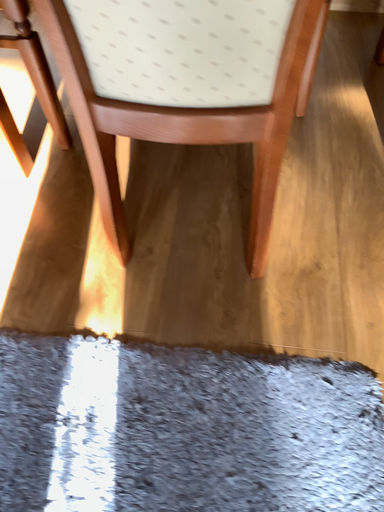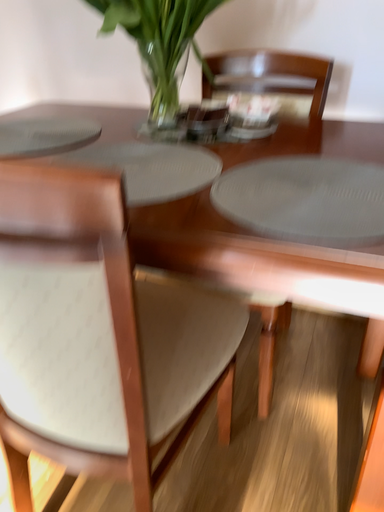
Question: Which way did the camera rotate in the video?

Choices:
 (A) rotated downward
 (B) rotated upward

Answer: (B)